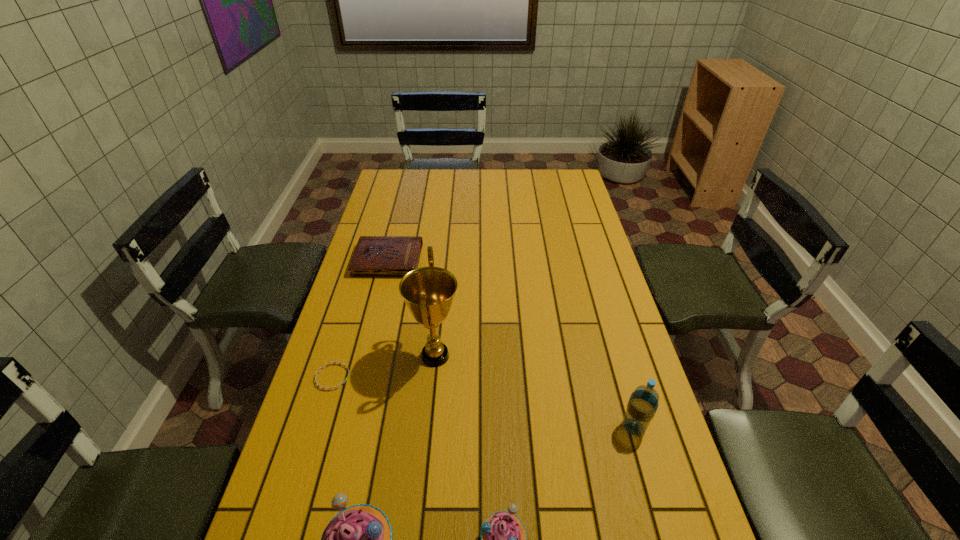
The height and width of the screenshot is (540, 960). In order to click on the farthest object in this screenshot , I will do `click(375, 256)`.

Where is `hardback book`? hardback book is located at coordinates (375, 256).

Image resolution: width=960 pixels, height=540 pixels. In order to click on the tallest object in this screenshot , I will do `click(428, 292)`.

This screenshot has width=960, height=540. In order to click on bracelet in this screenshot , I will do `click(341, 363)`.

In order to click on water bottle in this screenshot , I will do `click(643, 403)`.

You are a GUI agent. You are given a task and a screenshot of the screen. Output one action in this format:
    pyautogui.click(x=<x>, y=<y>)
    Task: Click on the rightmost object
    Image resolution: width=960 pixels, height=540 pixels.
    Given the screenshot: What is the action you would take?
    pyautogui.click(x=643, y=403)

Locate an element on the screen. The image size is (960, 540). vacant space situated 0.210m on the right of the second shortest object is located at coordinates (479, 261).

Locate an element on the screen. free space located 0.270m on the front view with handles of the award is located at coordinates [555, 356].

Image resolution: width=960 pixels, height=540 pixels. In order to click on blank space located on the surface of the bracelet showing star-shaped elements in this screenshot , I will do pos(372,377).

The width and height of the screenshot is (960, 540). I want to click on vacant space located on the left of the fourth farthest object, so click(532, 427).